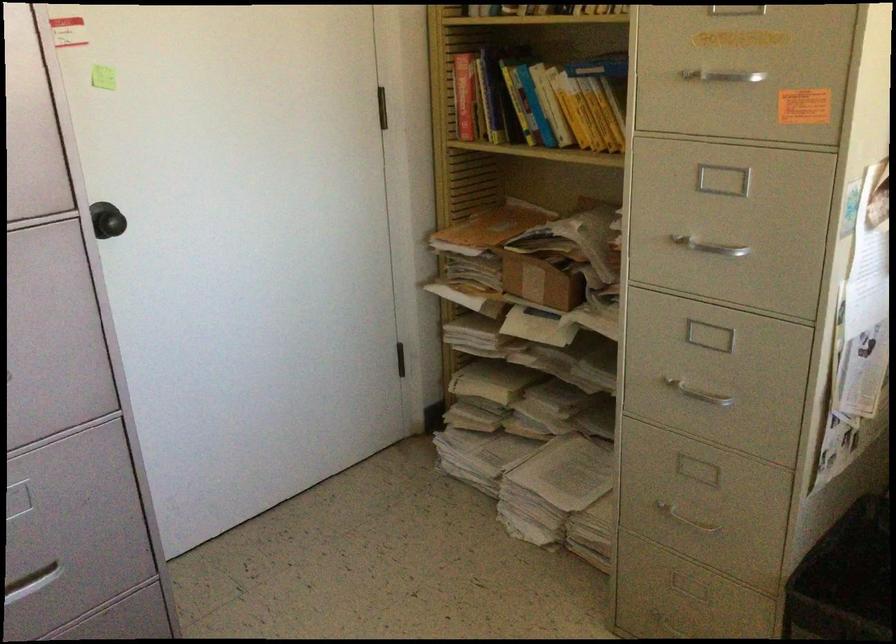
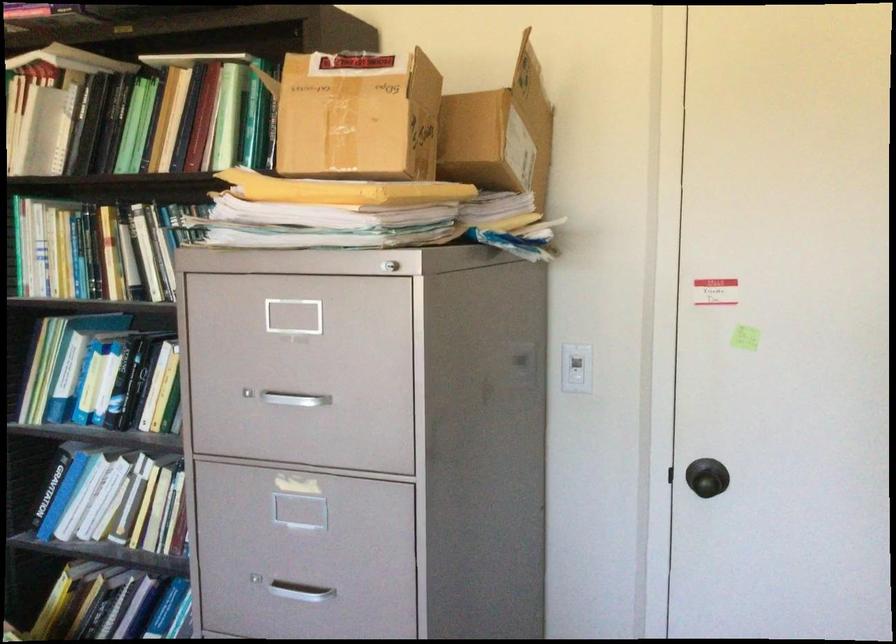
Question: The camera is either moving clockwise (left) or counter-clockwise (right) around the object. The first image is from the beginning of the video and the second image is from the end. Is the camera moving left or right when shooting the video?

Choices:
 (A) Left
 (B) Right

Answer: (B)